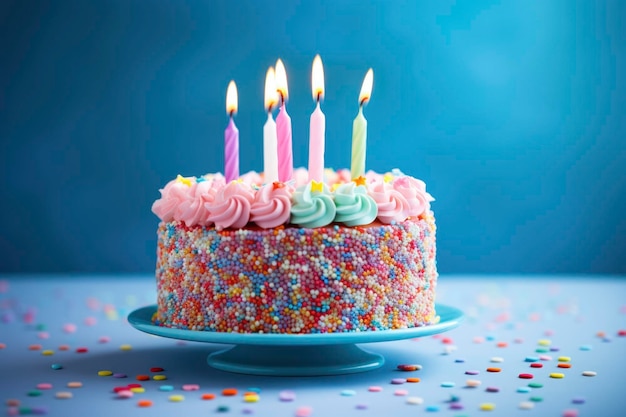
At what (x,y) coordinates should I click in order to perform the action: click on candle flames. Please return your answer as a coordinate pair (x, y). Looking at the image, I should click on (233, 95), (270, 84), (280, 79), (319, 77), (367, 83).